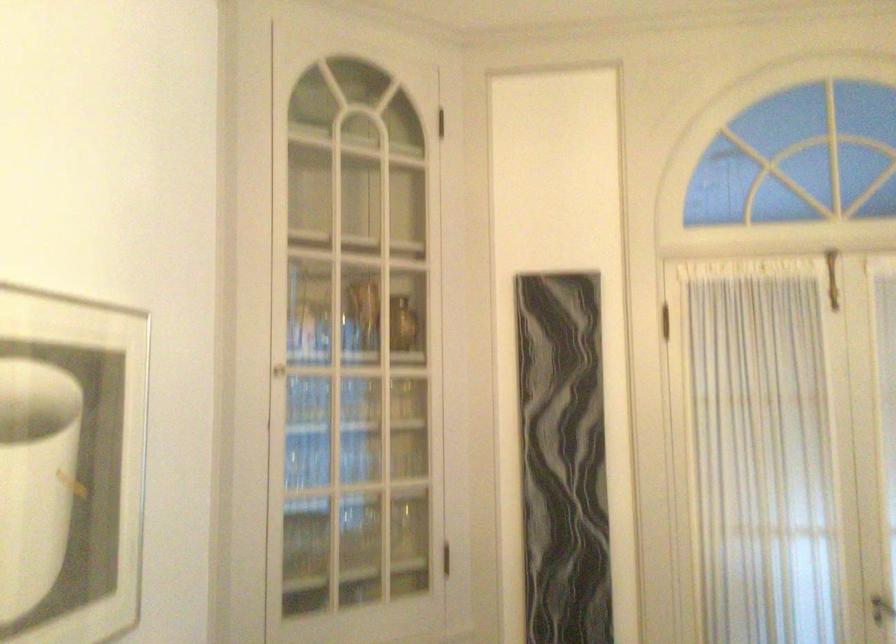
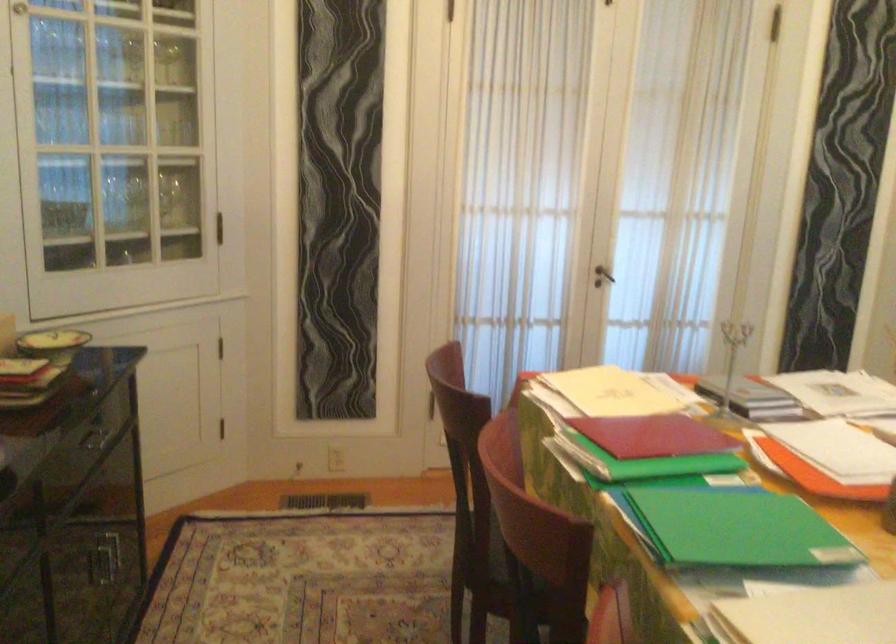
In a continuous first-person perspective shot, in which direction is the camera moving?

The cameraman walked toward left, backward.